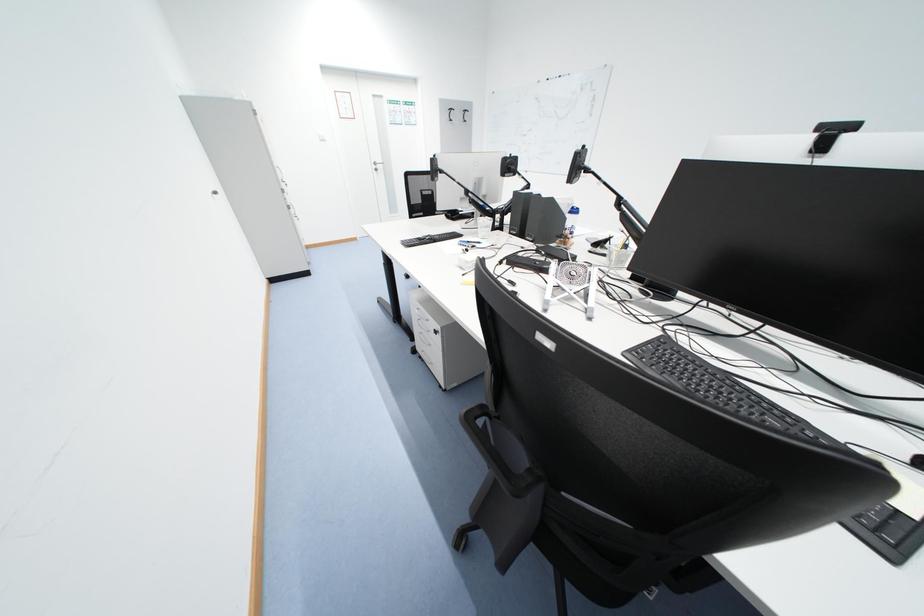
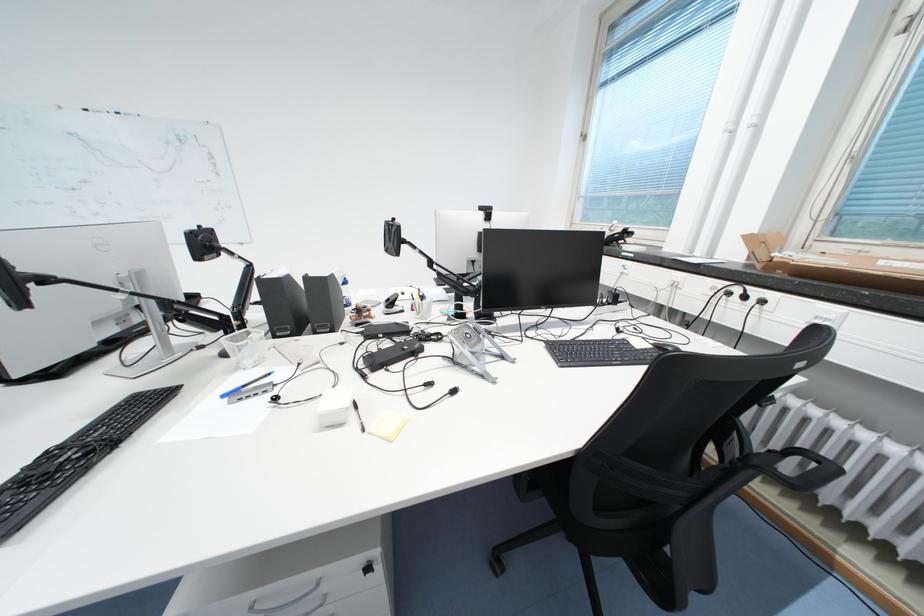
Question: Based on the continuous images, in which direction is the camera rotating? Reply with the corresponding letter.

Choices:
 (A) Left
 (B) Right
 (C) Up
 (D) Down

Answer: (B)